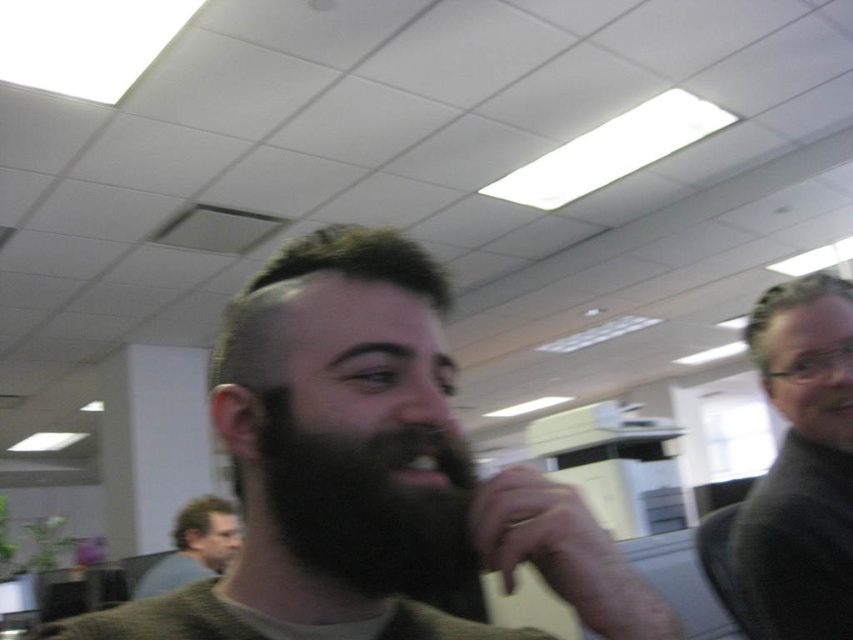
Which is more to the left, dark gray sweater at right or short dark hair at center?

short dark hair at center is more to the left.

Is dark gray sweater at right bigger than short dark hair at center?

Yes.

Does point (840, 356) come behind point (178, 547)?

No, (840, 356) is in front of (178, 547).

Find the location of `dark gray sweater at right`. dark gray sweater at right is located at coordinates (802, 464).

Which of these two, dark gray sweater at right or dark brown hair at lower left, stands taller?

Standing taller between the two is dark brown hair at lower left.

From the picture: Can you confirm if dark gray sweater at right is positioned to the right of dark brown hair at lower left?

Correct, you'll find dark gray sweater at right to the right of dark brown hair at lower left.

The image size is (853, 640). Describe the element at coordinates (802, 464) in the screenshot. I see `dark gray sweater at right` at that location.

Image resolution: width=853 pixels, height=640 pixels. What are the coordinates of `dark gray sweater at right` in the screenshot? It's located at pyautogui.click(x=802, y=464).

Measure the distance between dark brown thick beard at center and dark brown hair at lower left.

dark brown thick beard at center and dark brown hair at lower left are 8.07 feet apart from each other.

Find the location of a particular element. This screenshot has width=853, height=640. dark brown thick beard at center is located at coordinates (369, 504).

You are a GUI agent. You are given a task and a screenshot of the screen. Output one action in this format:
    pyautogui.click(x=<x>, y=<y>)
    Task: Click on the dark brown thick beard at center
    
    Given the screenshot: What is the action you would take?
    pyautogui.click(x=369, y=504)